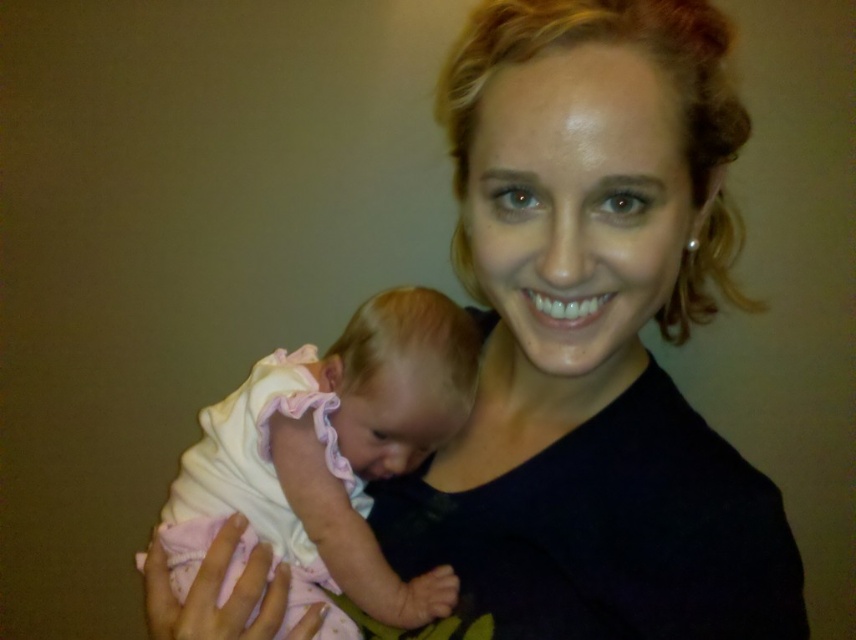
You are a photographer adjusting the focus on your camera. You notice two points in the image at coordinates point (248,486) and point (296,456). Which point is closer to the camera?

Point (248,486) is further to the viewer than point (296,456), so the point closer to the camera is point (296,456).

You are a photographer who wants to capture a photo of the white soft fabric baby at left and the pink fabric baby at center. Which baby is positioned more to the left side of the image?

The white soft fabric baby at left is positioned more to the left side of the image than the pink fabric baby at center.